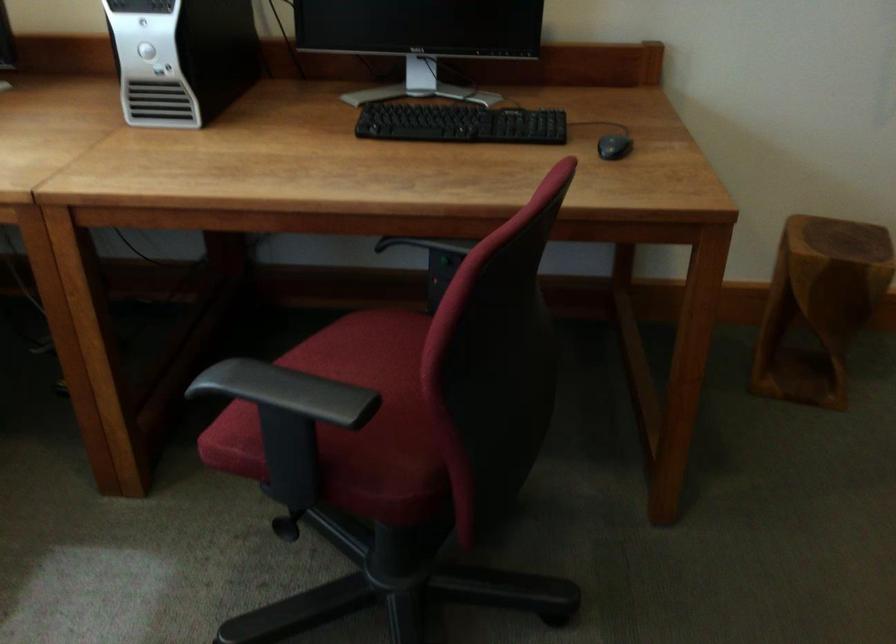
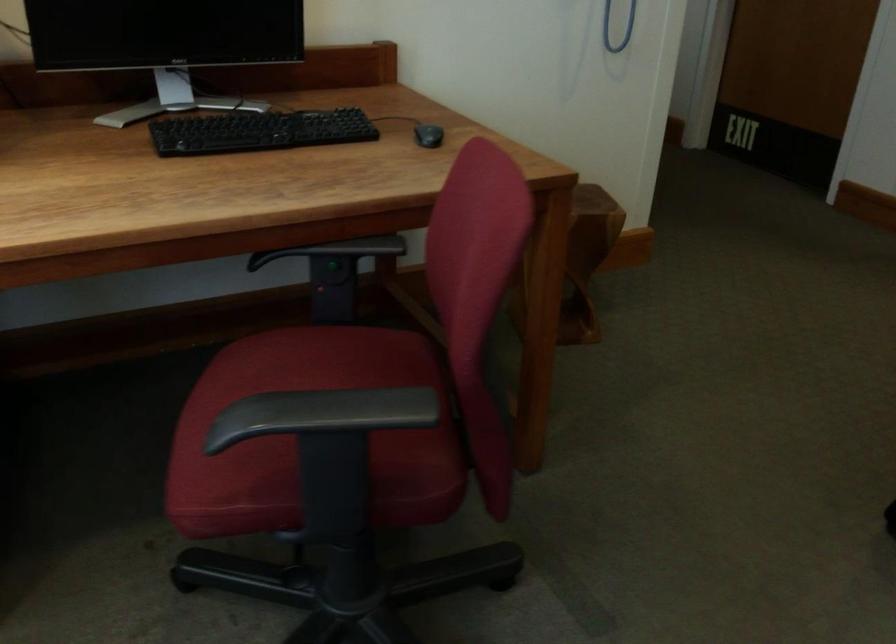
The point at (x=264, y=389) is marked in the first image. Where is the corresponding point in the second image?

(321, 413)